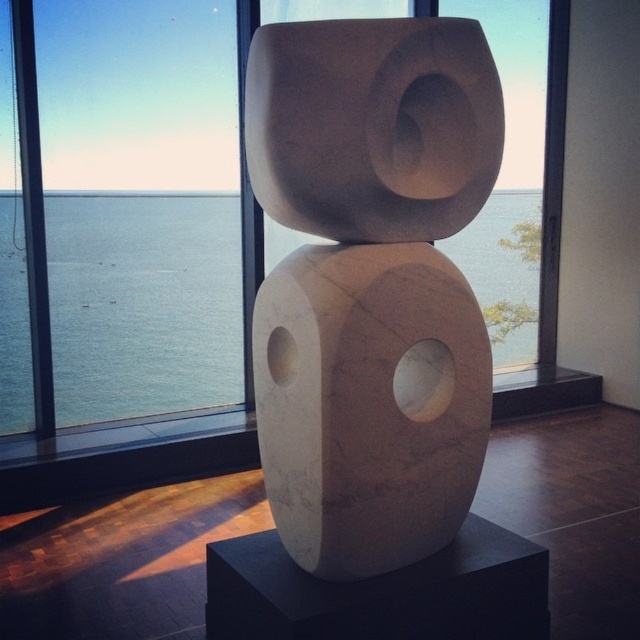
Does blue water at center have a greater height compared to transparent glass window at center?

Yes.

Is blue water at center to the right of transparent glass window at center from the viewer's perspective?

Incorrect, blue water at center is not on the right side of transparent glass window at center.

Identify the location of blue water at center. click(144, 305).

Which of these two, white marble sculpture at center or transparent glass window at center, stands shorter?

transparent glass window at center

Does white marble sculpture at center have a lesser height compared to transparent glass window at center?

No, white marble sculpture at center is not shorter than transparent glass window at center.

Identify the location of white marble sculpture at center. (371, 284).

Image resolution: width=640 pixels, height=640 pixels. I want to click on white marble sculpture at center, so click(371, 284).

Is white marble sculpture at center below blue water at center?

Actually, white marble sculpture at center is above blue water at center.

What are the coordinates of `white marble sculpture at center` in the screenshot? It's located at (371, 284).